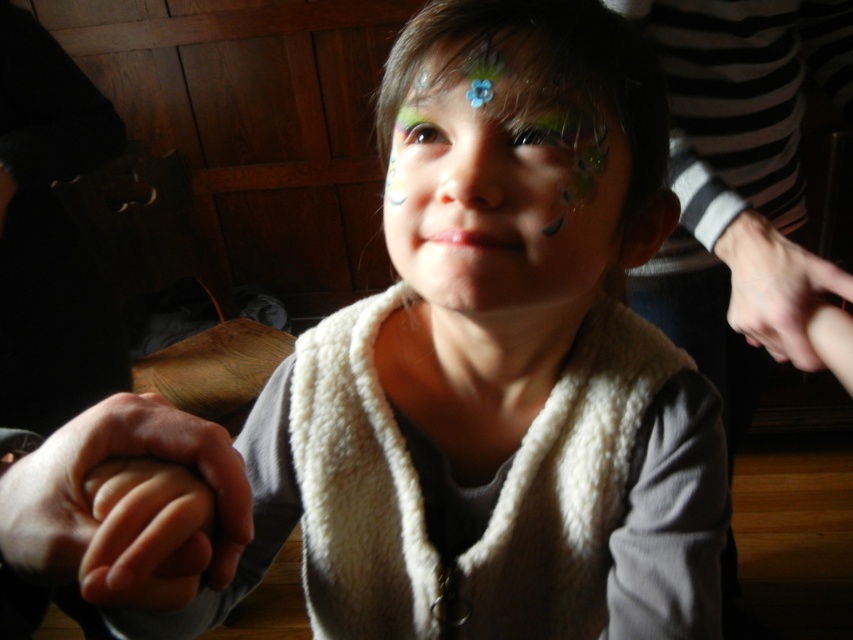
From the picture: Can you confirm if smooth skin hand at lower left is smaller than smooth skin hand at right?

Yes, smooth skin hand at lower left is smaller than smooth skin hand at right.

Between smooth skin hand at lower left and smooth skin hand at right, which one is positioned lower?

Positioned lower is smooth skin hand at lower left.

Is point (181, 412) positioned before point (793, 301)?

Yes, point (181, 412) is in front of point (793, 301).

Find the location of a particular element. smooth skin hand at lower left is located at coordinates (97, 464).

Is point (30, 538) closer to viewer compared to point (566, 90)?

That is True.

Which is in front, point (231, 456) or point (550, 93)?

Positioned in front is point (231, 456).

Identify the location of smooth skin hand at lower left. (97, 464).

Measure the distance between white fluffy vest at center and smooth skin hand at right.

A distance of 8.98 inches exists between white fluffy vest at center and smooth skin hand at right.

Is white fluffy vest at center wider than smooth skin hand at right?

Indeed, white fluffy vest at center has a greater width compared to smooth skin hand at right.

Describe the element at coordinates (502, 164) in the screenshot. I see `white fluffy vest at center` at that location.

Image resolution: width=853 pixels, height=640 pixels. Find the location of `white fluffy vest at center`. white fluffy vest at center is located at coordinates (502, 164).